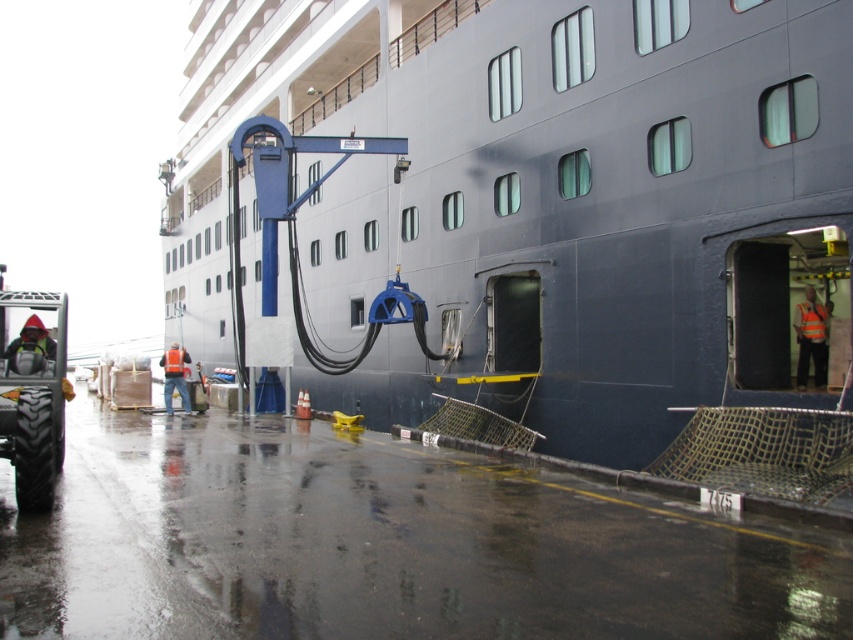
Where is `dark blue metal cruise ship at center`? dark blue metal cruise ship at center is located at coordinates (544, 202).

Does dark blue metal cruise ship at center have a greater width compared to brushed metal tractor at lower left?

Indeed, dark blue metal cruise ship at center has a greater width compared to brushed metal tractor at lower left.

The width and height of the screenshot is (853, 640). What do you see at coordinates (544, 202) in the screenshot? I see `dark blue metal cruise ship at center` at bounding box center [544, 202].

At what (x,y) coordinates should I click in order to perform the action: click on dark blue metal cruise ship at center. Please return your answer as a coordinate pair (x, y). The height and width of the screenshot is (640, 853). Looking at the image, I should click on click(x=544, y=202).